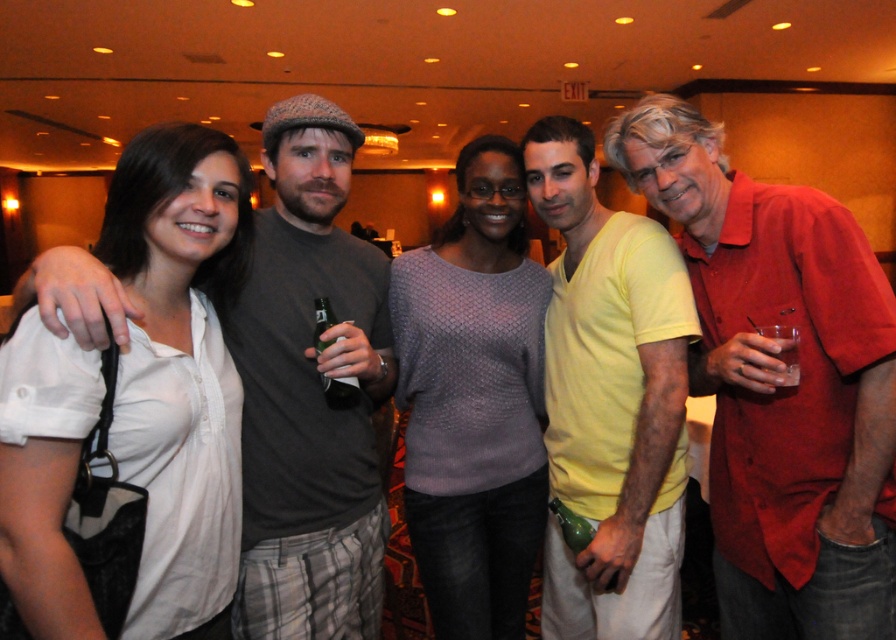
You are a photographer at the event and want to capture a photo of the knitted purple sweater at center without the green matte bottle at center blocking it. How should you adjust your camera angle?

The knitted purple sweater at center is positioned under the green matte bottle at center, so tilting the camera downward slightly would allow you to capture the sweater without the bottle blocking it.

You are at a party and want to grab your clear plastic cup at right without moving the matte red shirt at right. Is this possible?

The matte red shirt at right is in front of the clear plastic cup at right, so you cannot reach the clear plastic cup at right without moving the matte red shirt at right first.

From the picture: You are a photographer at the event and want to take a photo of the matte red shirt at right and the green matte bottle at center. Which object is positioned closer to you?

The matte red shirt at right is closer to the viewer than the green matte bottle at center.